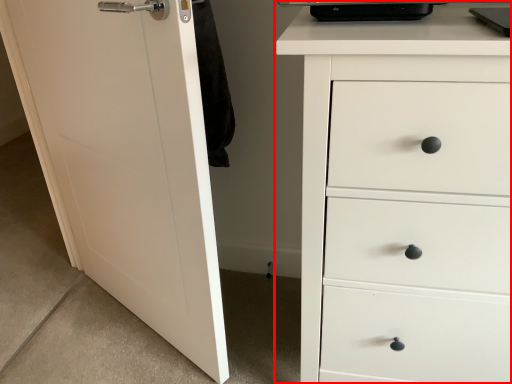
Question: From the image's perspective, where is chest of drawers (annotated by the red box) located in relation to door in the image?

Choices:
 (A) above
 (B) below

Answer: (B)